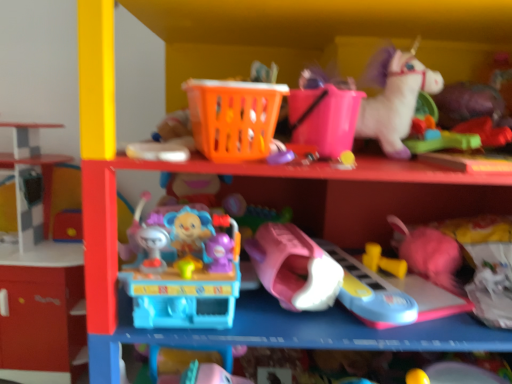
Question: Which direction should I rotate to look at pink plastic toy car at center, placed as the 7th toy when sorted from right to left, — up or down?

Choices:
 (A) down
 (B) up

Answer: (A)

Question: In which direction should I rotate to look at pink plastic bucket at upper center, positioned as the sixth toy in right-to-left order?

Choices:
 (A) left
 (B) right

Answer: (B)

Question: Is pink plastic toy car at center, the fourth toy in the left-to-right sequence, in front of rubberized green toy at upper right, which is the 10th toy in left-to-right order?

Choices:
 (A) no
 (B) yes

Answer: (B)

Question: Is pink plastic toy car at center, placed as the 7th toy when sorted from right to left, with rubberized green toy at upper right, which is the 10th toy in left-to-right order?

Choices:
 (A) yes
 (B) no

Answer: (B)

Question: From the image's perspective, would you say pink plastic toy car at center, the fourth toy in the left-to-right sequence, is positioned over rubberized green toy at upper right, which is the 10th toy in left-to-right order?

Choices:
 (A) no
 (B) yes

Answer: (A)

Question: Are pink plastic toy car at center, the fourth toy in the left-to-right sequence, and rubberized green toy at upper right, acting as the first toy starting from the right, far apart?

Choices:
 (A) yes
 (B) no

Answer: (B)

Question: Is pink plastic toy car at center, placed as the 7th toy when sorted from right to left, taller than rubberized green toy at upper right, acting as the first toy starting from the right?

Choices:
 (A) no
 (B) yes

Answer: (B)

Question: Does pink plastic toy car at center, placed as the 7th toy when sorted from right to left, have a greater width compared to rubberized green toy at upper right, which is the 10th toy in left-to-right order?

Choices:
 (A) no
 (B) yes

Answer: (B)

Question: Can you confirm if translucent plastic toy at center, the 1th toy when ordered from left to right, is smaller than yellow rubber dumbbells at lower center, acting as the eighth toy starting from the left?

Choices:
 (A) no
 (B) yes

Answer: (A)

Question: Would you consider translucent plastic toy at center, the 1th toy when ordered from left to right, to be distant from yellow rubber dumbbells at lower center, the 3th toy positioned from the right?

Choices:
 (A) no
 (B) yes

Answer: (A)

Question: From a real-world perspective, is translucent plastic toy at center, the 1th toy when ordered from left to right, positioned over yellow rubber dumbbells at lower center, acting as the eighth toy starting from the left, based on gravity?

Choices:
 (A) no
 (B) yes

Answer: (B)

Question: Does translucent plastic toy at center, which appears as the 10th toy when viewed from the right, appear on the left side of yellow rubber dumbbells at lower center, the 3th toy positioned from the right?

Choices:
 (A) yes
 (B) no

Answer: (A)

Question: Does translucent plastic toy at center, which appears as the 10th toy when viewed from the right, have a greater height compared to yellow rubber dumbbells at lower center, the 3th toy positioned from the right?

Choices:
 (A) yes
 (B) no

Answer: (A)

Question: Is translucent plastic toy at center, which appears as the 10th toy when viewed from the right, positioned with its back to yellow rubber dumbbells at lower center, acting as the eighth toy starting from the left?

Choices:
 (A) yes
 (B) no

Answer: (B)

Question: Considering the relative sizes of pink plastic bucket at upper center, positioned as the sixth toy in right-to-left order, and green rubber toy at upper right, placed as the 9th toy when sorted from left to right, in the image provided, is pink plastic bucket at upper center, positioned as the sixth toy in right-to-left order, shorter than green rubber toy at upper right, placed as the 9th toy when sorted from left to right,?

Choices:
 (A) no
 (B) yes

Answer: (A)